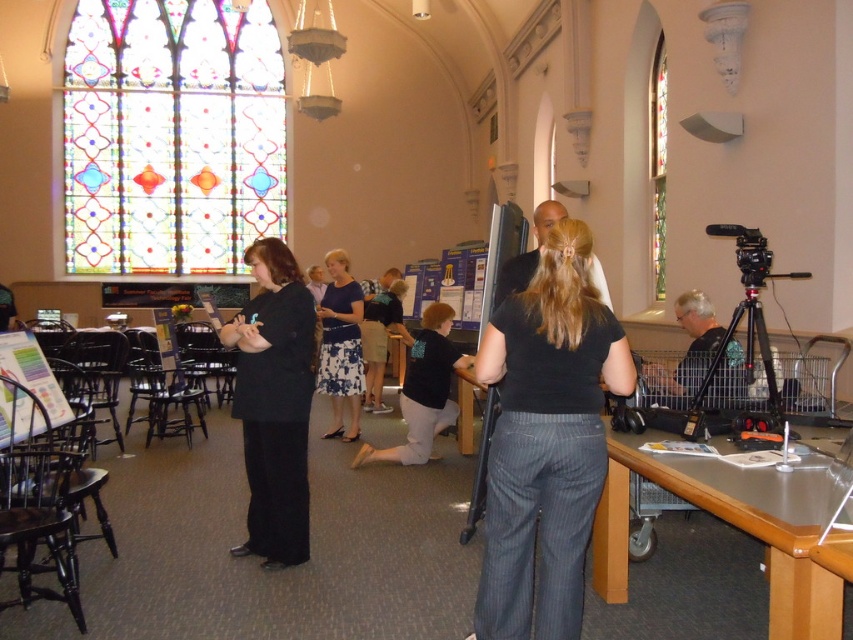
You are organizing a small event in this space and need to place a large centerpiece on the metallic gray table at lower right. Considering the size of the blue floral dress at center, will the table be able to accommodate the centerpiece without overcrowding?

The metallic gray table at lower right is bigger than the blue floral dress at center, so it should have enough space to accommodate a large centerpiece without overcrowding.

You are standing in the church and want to move from the stained glass window at upper left to the black pinstripe pants at center. Which direction should you move?

The stained glass window at upper left is to the left of the black pinstripe pants at center, so you should move to the right to reach the black pinstripe pants at center from the stained glass window at upper left.

You are standing at point (303, 561) and want to walk to the stained glass window in the background. Is point (527, 317) located between you and the stained glass window?

Yes, point (527, 317) is located between you and the stained glass window because it is in front of point (303, 561), which is your current position.